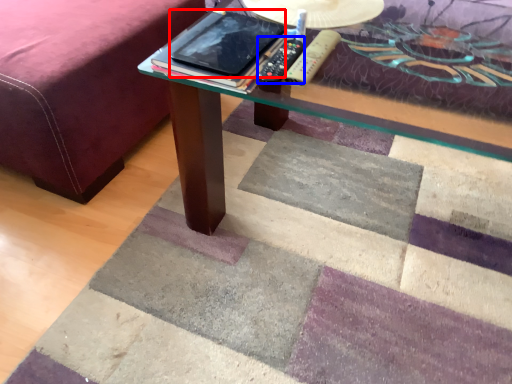
Question: Which object appears closest to the camera in this image, tablet computer (highlighted by a red box) or remote (highlighted by a blue box)?

Choices:
 (A) tablet computer
 (B) remote

Answer: (A)